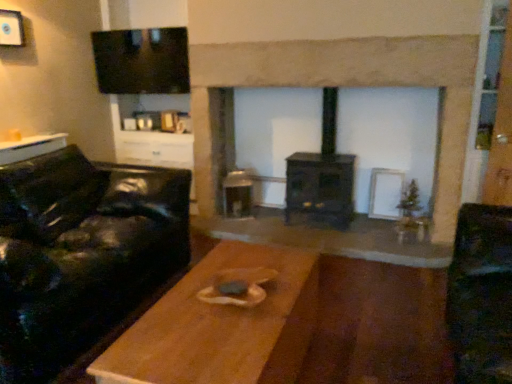
In order to click on free space to the right of wooden table at center, which is the second table from top to bottom in this screenshot , I will do `click(370, 342)`.